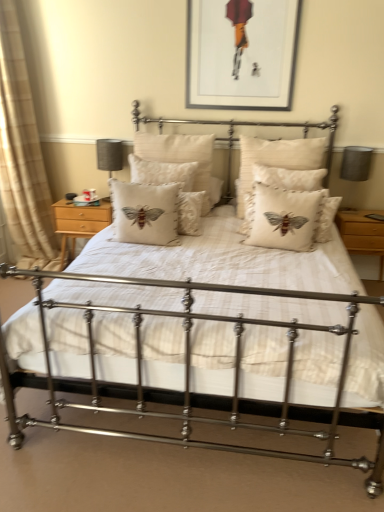
Question: Is beige linen cushion with embroidered moth at center, the second pillow from the left, closer to the viewer compared to matte gray lampshade at right, the 1th table lamp in the right-to-left sequence?

Choices:
 (A) no
 (B) yes

Answer: (B)

Question: Is beige linen cushion with embroidered moth at center, the second pillow from the left, far from matte gray lampshade at right, the second table lamp positioned from the left?

Choices:
 (A) no
 (B) yes

Answer: (B)

Question: Is beige linen cushion with embroidered moth at center, the third pillow in the right-to-left sequence, bigger than matte gray lampshade at right, the 1th table lamp in the right-to-left sequence?

Choices:
 (A) yes
 (B) no

Answer: (A)

Question: Would you say matte gray lampshade at right, the 1th table lamp in the right-to-left sequence, is part of beige linen cushion with embroidered moth at center, the third pillow in the right-to-left sequence,'s contents?

Choices:
 (A) yes
 (B) no

Answer: (B)

Question: Is beige linen cushion with embroidered moth at center, the third pillow in the right-to-left sequence, facing away from matte gray lampshade at right, the second table lamp positioned from the left?

Choices:
 (A) no
 (B) yes

Answer: (A)

Question: From the image's perspective, is wooden nightstand at right, the first nightstand when ordered from right to left, positioned above or below matte gray lampshade at left, positioned as the first table lamp in left-to-right order?

Choices:
 (A) below
 (B) above

Answer: (A)

Question: Considering the positions of wooden nightstand at right, the first nightstand when ordered from right to left, and matte gray lampshade at left, positioned as the first table lamp in left-to-right order, in the image, is wooden nightstand at right, the first nightstand when ordered from right to left, wider or thinner than matte gray lampshade at left, positioned as the first table lamp in left-to-right order,?

Choices:
 (A) wide
 (B) thin

Answer: (A)

Question: Is wooden nightstand at right, the second nightstand in the left-to-right sequence, to the left or to the right of matte gray lampshade at left, positioned as the first table lamp in left-to-right order, in the image?

Choices:
 (A) right
 (B) left

Answer: (A)

Question: Is wooden nightstand at right, the second nightstand in the left-to-right sequence, in front of or behind matte gray lampshade at left, the second table lamp when ordered from right to left, in the image?

Choices:
 (A) front
 (B) behind

Answer: (A)

Question: From a real-world perspective, is light wood/finely crafted nightstand at left, arranged as the first nightstand when viewed from the left, physically located above or below beige embroidered cushion at center, positioned as the third pillow in left-to-right order?

Choices:
 (A) below
 (B) above

Answer: (A)

Question: Is point (99, 224) positioned closer to the camera than point (269, 245)?

Choices:
 (A) farther
 (B) closer

Answer: (A)

Question: Is light wood/finely crafted nightstand at left, which is the 2th nightstand from right to left, in front of or behind beige embroidered cushion at center, which ranks as the second pillow in right-to-left order, in the image?

Choices:
 (A) front
 (B) behind

Answer: (B)

Question: In terms of width, does light wood/finely crafted nightstand at left, arranged as the first nightstand when viewed from the left, look wider or thinner when compared to beige embroidered cushion at center, positioned as the third pillow in left-to-right order?

Choices:
 (A) wide
 (B) thin

Answer: (A)

Question: Is beige cotton cushion with embroidered bee at center, positioned as the first pillow in left-to-right order, inside or outside of creamy linen cushion with embroidered bee at center, marked as the first pillow in a right-to-left arrangement?

Choices:
 (A) outside
 (B) inside

Answer: (A)

Question: From their relative heights in the image, would you say beige cotton cushion with embroidered bee at center, positioned as the first pillow in left-to-right order, is taller or shorter than creamy linen cushion with embroidered bee at center, the fourth pillow viewed from the left?

Choices:
 (A) tall
 (B) short

Answer: (B)